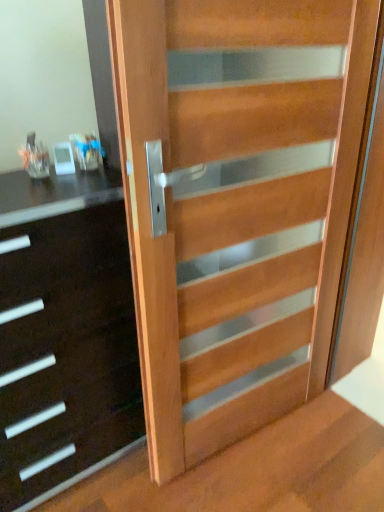
Question: From the image's perspective, is wooden stairwell at lower right under black glossy chest of drawers at left?

Choices:
 (A) yes
 (B) no

Answer: (A)

Question: Is wooden stairwell at lower right at the right side of black glossy chest of drawers at left?

Choices:
 (A) no
 (B) yes

Answer: (B)

Question: Is wooden stairwell at lower right far from black glossy chest of drawers at left?

Choices:
 (A) yes
 (B) no

Answer: (B)

Question: Does wooden stairwell at lower right have a lesser height compared to black glossy chest of drawers at left?

Choices:
 (A) yes
 (B) no

Answer: (A)

Question: Does wooden stairwell at lower right have a greater width compared to black glossy chest of drawers at left?

Choices:
 (A) yes
 (B) no

Answer: (A)

Question: Is point (256, 211) positioned closer to the camera than point (226, 473)?

Choices:
 (A) farther
 (B) closer

Answer: (B)

Question: Considering the positions of natural wood door at center and wooden stairwell at lower right in the image, is natural wood door at center wider or thinner than wooden stairwell at lower right?

Choices:
 (A) thin
 (B) wide

Answer: (A)

Question: From a real-world perspective, is natural wood door at center positioned above or below wooden stairwell at lower right?

Choices:
 (A) above
 (B) below

Answer: (A)

Question: Based on their sizes in the image, would you say natural wood door at center is bigger or smaller than wooden stairwell at lower right?

Choices:
 (A) big
 (B) small

Answer: (A)

Question: Is wooden stairwell at lower right wider or thinner than natural wood door at center?

Choices:
 (A) thin
 (B) wide

Answer: (B)

Question: Does point (175, 494) appear closer or farther from the camera than point (269, 321)?

Choices:
 (A) closer
 (B) farther

Answer: (A)

Question: From a real-world perspective, is wooden stairwell at lower right positioned above or below natural wood door at center?

Choices:
 (A) above
 (B) below

Answer: (B)

Question: Is wooden stairwell at lower right in front of or behind natural wood door at center in the image?

Choices:
 (A) front
 (B) behind

Answer: (B)

Question: From a real-world perspective, is natural wood door at center positioned above or below black glossy chest of drawers at left?

Choices:
 (A) below
 (B) above

Answer: (B)

Question: Choose the correct answer: Is natural wood door at center inside black glossy chest of drawers at left or outside it?

Choices:
 (A) inside
 (B) outside

Answer: (B)